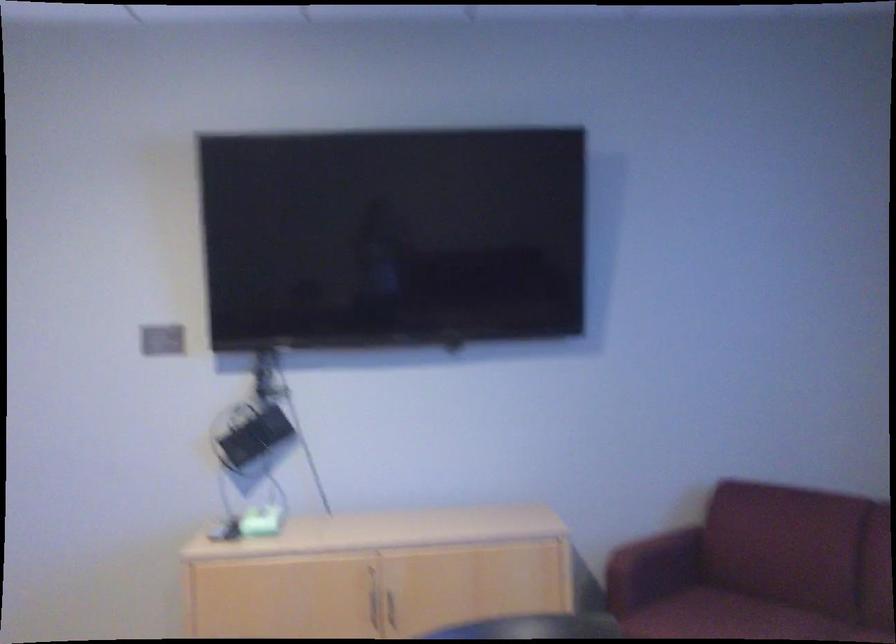
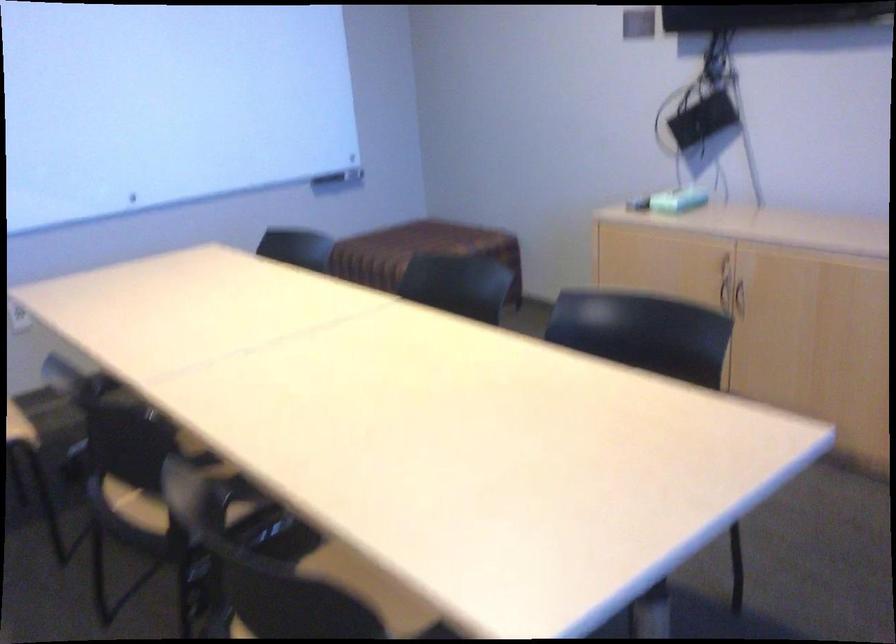
In the second image, find the point that corresponds to (261,526) in the first image.

(677, 200)